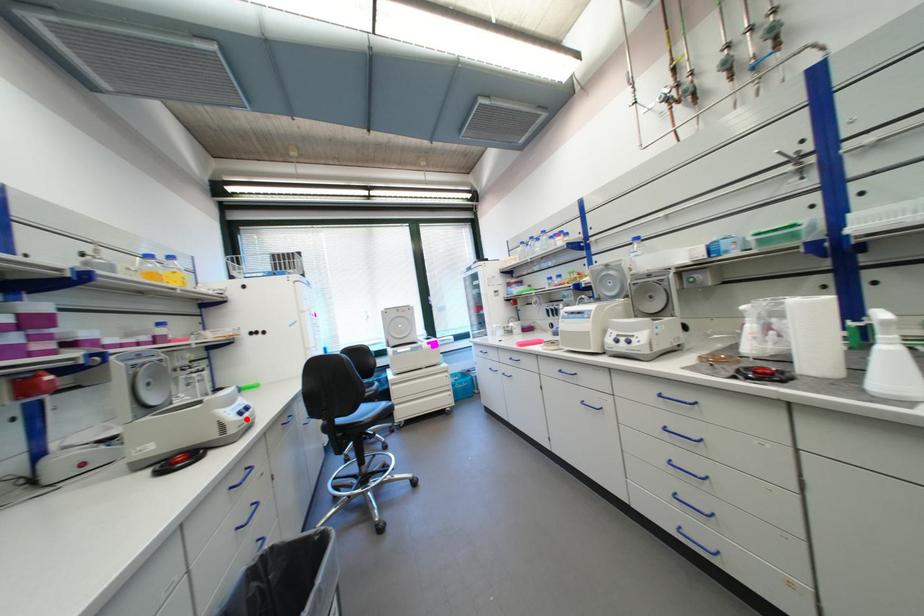
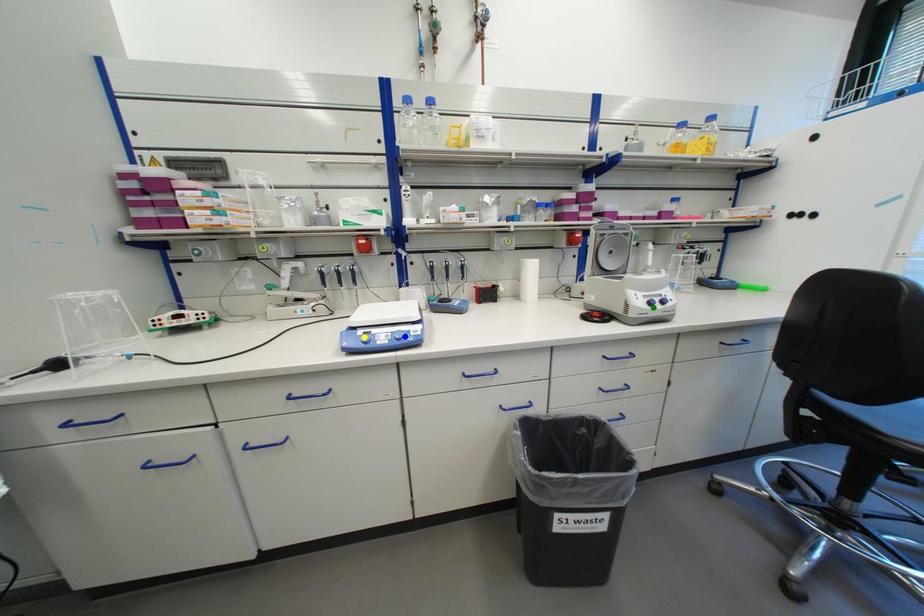
Question: I am providing you with two images of the same scene from different viewpoints. A red point is marked on the first image. You are given multiple points on the second image. Which mark in image 2 goes with the point in image 1?

Choices:
 (A) blue point
 (B) yellow point
 (C) green point

Answer: (C)